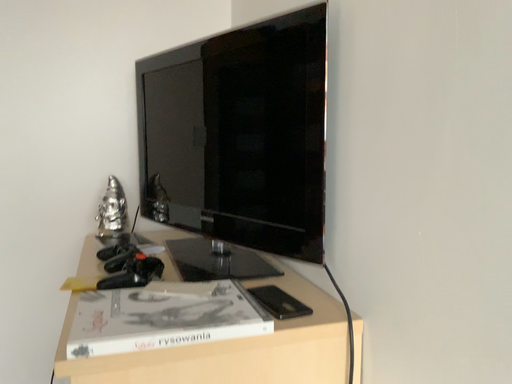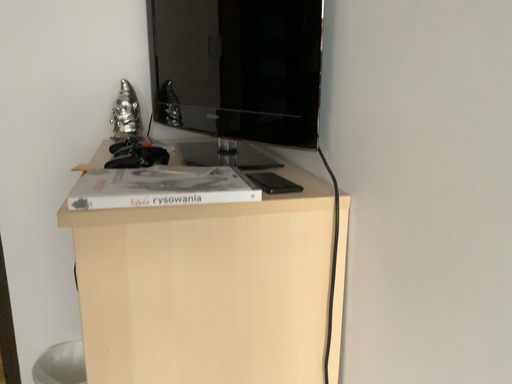
Question: How did the camera likely rotate when shooting the video?

Choices:
 (A) rotated downward
 (B) rotated upward

Answer: (A)